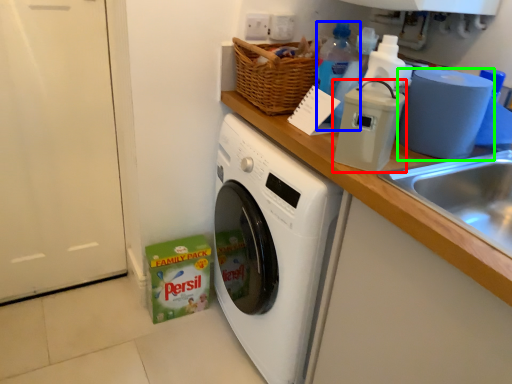
Question: Considering the real-world distances, which object is farthest from appliance (highlighted by a red box)? bottle (highlighted by a blue box) or toilet paper (highlighted by a green box)?

Choices:
 (A) bottle
 (B) toilet paper

Answer: (A)